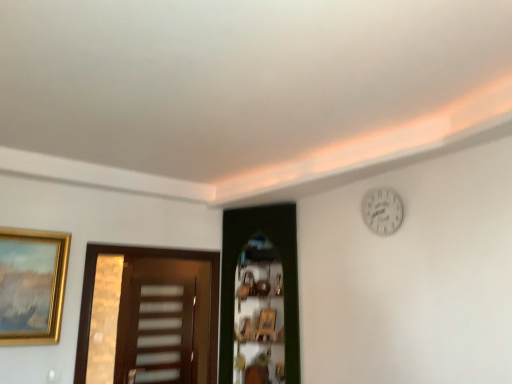
You are a GUI agent. You are given a task and a screenshot of the screen. Output one action in this format:
    pyautogui.click(x=<x>, y=<y>)
    Task: Click on the translucent plastic screen door at center
    This screenshot has height=384, width=512.
    Given the screenshot: What is the action you would take?
    pyautogui.click(x=160, y=330)

In order to click on brown wooden door at left, the 2th door from the right in this screenshot , I will do `click(148, 316)`.

The width and height of the screenshot is (512, 384). What do you see at coordinates (148, 316) in the screenshot?
I see `brown wooden door at left, which appears as the first door when viewed from the left` at bounding box center [148, 316].

Locate an element on the screen. The width and height of the screenshot is (512, 384). green wooden door at center, which ranks as the 1th door in right-to-left order is located at coordinates (284, 276).

Locate an element on the screen. The width and height of the screenshot is (512, 384). translucent plastic screen door at center is located at coordinates (160, 330).

Is green wooden door at center, which ranks as the second door in left-to-right order, taller than translucent plastic screen door at center?

Indeed, green wooden door at center, which ranks as the second door in left-to-right order, has a greater height compared to translucent plastic screen door at center.

How far apart are green wooden door at center, which ranks as the 1th door in right-to-left order, and translucent plastic screen door at center?

green wooden door at center, which ranks as the 1th door in right-to-left order, and translucent plastic screen door at center are 1.37 meters apart.

Considering the sizes of objects green wooden door at center, which ranks as the 1th door in right-to-left order, and translucent plastic screen door at center in the image provided, who is wider, green wooden door at center, which ranks as the 1th door in right-to-left order, or translucent plastic screen door at center?

green wooden door at center, which ranks as the 1th door in right-to-left order, is wider.

From a real-world perspective, is green wooden door at center, which ranks as the 1th door in right-to-left order, positioned under translucent plastic screen door at center based on gravity?

No, from a real-world perspective, green wooden door at center, which ranks as the 1th door in right-to-left order, is not under translucent plastic screen door at center.

Who is taller, translucent plastic screen door at center or brown wooden door at left, the 2th door from the right?

translucent plastic screen door at center is taller.

Does translucent plastic screen door at center contain brown wooden door at left, which appears as the first door when viewed from the left?

No.

Does translucent plastic screen door at center have a larger size compared to brown wooden door at left, the 2th door from the right?

No, translucent plastic screen door at center is not bigger than brown wooden door at left, the 2th door from the right.

Which is in front, point (184, 368) or point (170, 305)?

Point (184, 368)

Is white matte clock at upper right bigger than green wooden door at center, which ranks as the second door in left-to-right order?

No, white matte clock at upper right is not bigger than green wooden door at center, which ranks as the second door in left-to-right order.

Considering the sizes of objects white matte clock at upper right and green wooden door at center, which ranks as the second door in left-to-right order, in the image provided, who is taller, white matte clock at upper right or green wooden door at center, which ranks as the second door in left-to-right order,?

green wooden door at center, which ranks as the second door in left-to-right order.

From a real-world perspective, which object stands above the other?

white matte clock at upper right.

Is white matte clock at upper right thinner than green wooden door at center, which ranks as the second door in left-to-right order?

Correct, the width of white matte clock at upper right is less than that of green wooden door at center, which ranks as the second door in left-to-right order.

Is brown wooden door at left, which appears as the first door when viewed from the left, inside gold metallic picture frame at left?

No, brown wooden door at left, which appears as the first door when viewed from the left, is not inside gold metallic picture frame at left.

From the image's perspective, is gold metallic picture frame at left over brown wooden door at left, which appears as the first door when viewed from the left?

Yes, from the image's perspective, gold metallic picture frame at left is over brown wooden door at left, which appears as the first door when viewed from the left.

Is point (32, 307) less distant than point (124, 267)?

Yes, it is in front of point (124, 267).

From the image's perspective, which one is positioned lower, gold metallic picture frame at left or green wooden door at center, which ranks as the second door in left-to-right order?

green wooden door at center, which ranks as the second door in left-to-right order.

Considering the positions of points (56, 331) and (275, 221), is point (56, 331) farther from camera compared to point (275, 221)?

No, it is in front of (275, 221).

Based on the photo, from a real-world perspective, is gold metallic picture frame at left over green wooden door at center, which ranks as the 1th door in right-to-left order?

Indeed, from a real-world perspective, gold metallic picture frame at left stands above green wooden door at center, which ranks as the 1th door in right-to-left order.

Which is correct: gold metallic picture frame at left is inside green wooden door at center, which ranks as the 1th door in right-to-left order, or outside of it?

gold metallic picture frame at left is spatially situated outside green wooden door at center, which ranks as the 1th door in right-to-left order.

Is brown wooden door at left, the 2th door from the right, facing away from green wooden door at center, which ranks as the 1th door in right-to-left order?

No, brown wooden door at left, the 2th door from the right, is not facing away from green wooden door at center, which ranks as the 1th door in right-to-left order.

From a real-world perspective, is brown wooden door at left, which appears as the first door when viewed from the left, located beneath green wooden door at center, which ranks as the 1th door in right-to-left order?

Yes.

Can we say brown wooden door at left, which appears as the first door when viewed from the left, lies outside green wooden door at center, which ranks as the 1th door in right-to-left order?

Indeed, brown wooden door at left, which appears as the first door when viewed from the left, is completely outside green wooden door at center, which ranks as the 1th door in right-to-left order.

From their relative heights in the image, would you say brown wooden door at left, the 2th door from the right, is taller or shorter than green wooden door at center, which ranks as the second door in left-to-right order?

brown wooden door at left, the 2th door from the right, is shorter than green wooden door at center, which ranks as the second door in left-to-right order.

How different are the orientations of brown wooden door at left, which appears as the first door when viewed from the left, and translucent plastic screen door at center in degrees?

0.183 degrees separate the facing orientations of brown wooden door at left, which appears as the first door when viewed from the left, and translucent plastic screen door at center.

Is brown wooden door at left, which appears as the first door when viewed from the left, aimed at translucent plastic screen door at center?

No, brown wooden door at left, which appears as the first door when viewed from the left, is not facing towards translucent plastic screen door at center.

Find the location of `screen door that is under the brown wooden door at left, the 2th door from the right (from a real-world perspective)`. screen door that is under the brown wooden door at left, the 2th door from the right (from a real-world perspective) is located at coordinates (160, 330).

Is brown wooden door at left, which appears as the first door when viewed from the left, taller or shorter than translucent plastic screen door at center?

Considering their sizes, brown wooden door at left, which appears as the first door when viewed from the left, has less height than translucent plastic screen door at center.

Where is `screen door lying on the left of green wooden door at center, which ranks as the second door in left-to-right order`? This screenshot has width=512, height=384. screen door lying on the left of green wooden door at center, which ranks as the second door in left-to-right order is located at coordinates (160, 330).

In the image, there is a brown wooden door at left, which appears as the first door when viewed from the left. At what (x,y) coordinates should I click in order to perform the action: click on screen door below it (from the image's perspective). Please return your answer as a coordinate pair (x, y). Looking at the image, I should click on (160, 330).

Looking at the image, which one is located closer to white matte clock at upper right, green wooden door at center, which ranks as the second door in left-to-right order, or gold metallic picture frame at left?

The object closer to white matte clock at upper right is green wooden door at center, which ranks as the second door in left-to-right order.

When comparing their distances from gold metallic picture frame at left, does translucent plastic screen door at center or white matte clock at upper right seem closer?

Based on the image, translucent plastic screen door at center appears to be nearer to gold metallic picture frame at left.

Based on their spatial positions, is gold metallic picture frame at left or translucent plastic screen door at center further from green wooden door at center, which ranks as the second door in left-to-right order?

translucent plastic screen door at center is further to green wooden door at center, which ranks as the second door in left-to-right order.

Which object lies further to the anchor point white matte clock at upper right, brown wooden door at left, the 2th door from the right, or green wooden door at center, which ranks as the 1th door in right-to-left order?

The object further to white matte clock at upper right is brown wooden door at left, the 2th door from the right.

Looking at the image, which one is located closer to white matte clock at upper right, green wooden door at center, which ranks as the second door in left-to-right order, or translucent plastic screen door at center?

Based on the image, green wooden door at center, which ranks as the second door in left-to-right order, appears to be nearer to white matte clock at upper right.

Estimate the real-world distances between objects in this image. Which object is further from translucent plastic screen door at center, brown wooden door at left, which appears as the first door when viewed from the left, or white matte clock at upper right?

white matte clock at upper right is further to translucent plastic screen door at center.

From the image, which object appears to be farther from green wooden door at center, which ranks as the second door in left-to-right order, white matte clock at upper right or brown wooden door at left, the 2th door from the right?

brown wooden door at left, the 2th door from the right, lies further to green wooden door at center, which ranks as the second door in left-to-right order, than the other object.

From the image, which object appears to be nearer to gold metallic picture frame at left, translucent plastic screen door at center or brown wooden door at left, which appears as the first door when viewed from the left?

brown wooden door at left, which appears as the first door when viewed from the left, is closer to gold metallic picture frame at left.

Find the location of a particular element. Image resolution: width=512 pixels, height=384 pixels. screen door between gold metallic picture frame at left and white matte clock at upper right from left to right is located at coordinates click(160, 330).

This screenshot has width=512, height=384. In order to click on door between brown wooden door at left, the 2th door from the right, and white matte clock at upper right from left to right in this screenshot , I will do `click(284, 276)`.

Find the location of a particular element. Image resolution: width=512 pixels, height=384 pixels. door positioned between brown wooden door at left, which appears as the first door when viewed from the left, and translucent plastic screen door at center from near to far is located at coordinates (284, 276).

The image size is (512, 384). Identify the location of door between gold metallic picture frame at left and green wooden door at center, which ranks as the 1th door in right-to-left order, in the horizontal direction. (148, 316).